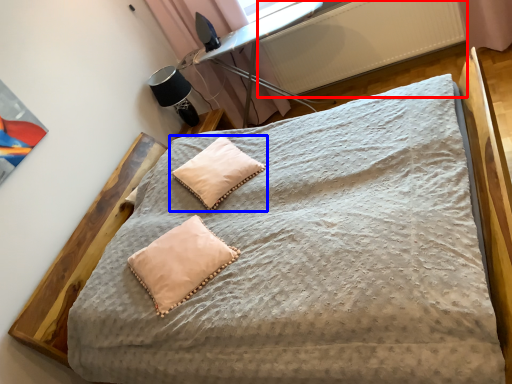
Question: Which point is further to the camera, radiator (highlighted by a red box) or pillow (highlighted by a blue box)?

Choices:
 (A) radiator
 (B) pillow

Answer: (A)